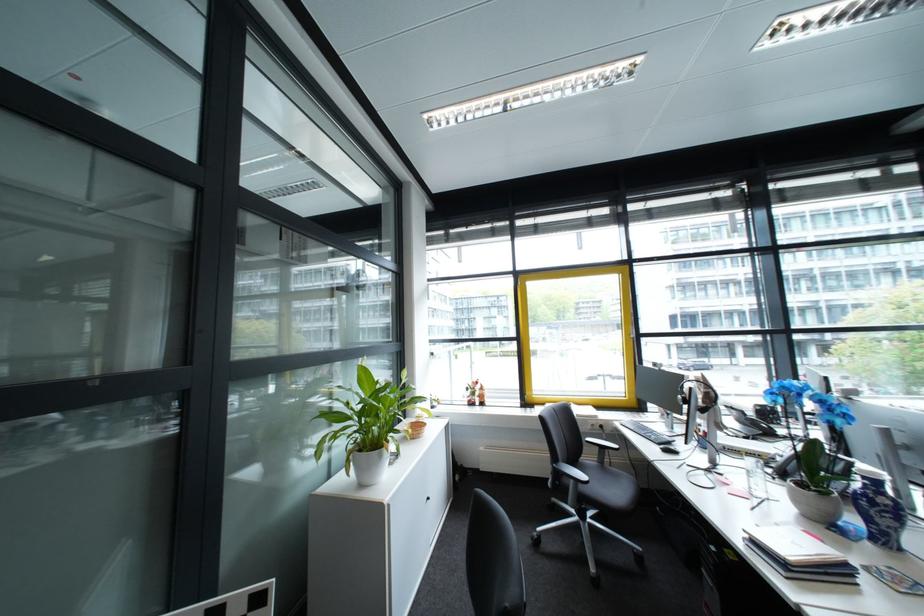
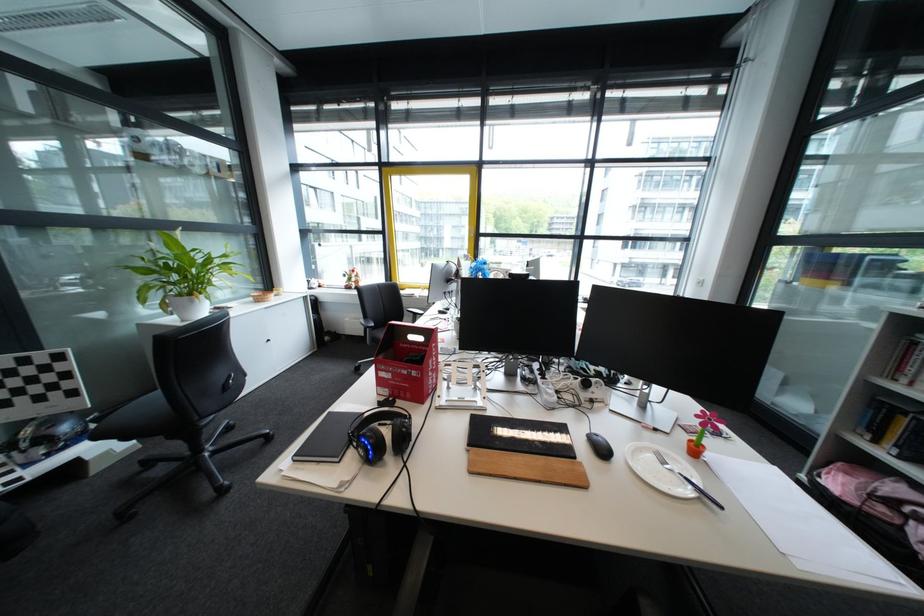
The point at (394, 456) is marked in the first image. Where is the corresponding point in the second image?

(207, 302)